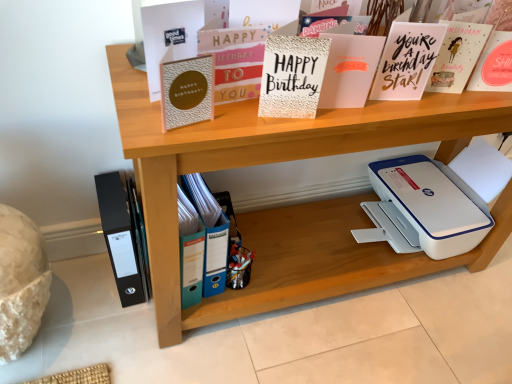
Identify the location of free space in front of gold textured card at upper center, which is the sixth paperback book from right to left. This screenshot has width=512, height=384. (165, 139).